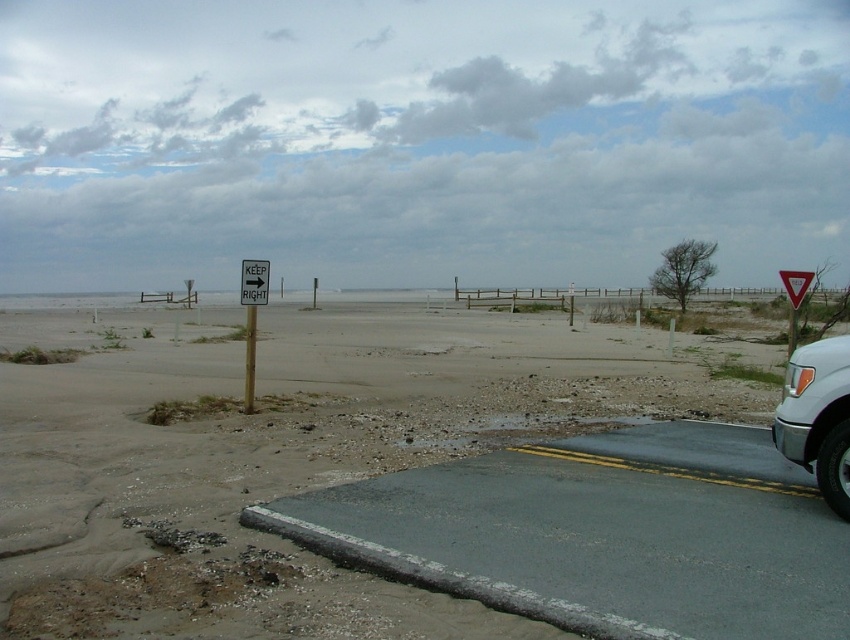
Question: Which point is closer to the camera taking this photo?

Choices:
 (A) (836, 408)
 (B) (199, 355)
 (C) (248, 324)

Answer: (A)

Question: Considering the relative positions of white matte truck at right and white plastic sign at center in the image provided, where is white matte truck at right located with respect to white plastic sign at center?

Choices:
 (A) left
 (B) right

Answer: (B)

Question: Is sandy beach at lower left to the right of white plastic sign at center from the viewer's perspective?

Choices:
 (A) yes
 (B) no

Answer: (A)

Question: Can you confirm if sandy beach at lower left is positioned below white plastic sign at center?

Choices:
 (A) no
 (B) yes

Answer: (B)

Question: Which point is farther to the camera?

Choices:
 (A) sandy beach at lower left
 (B) white matte truck at right

Answer: (B)

Question: Which of the following is the closest to the observer?

Choices:
 (A) sandy beach at lower left
 (B) white matte truck at right

Answer: (A)